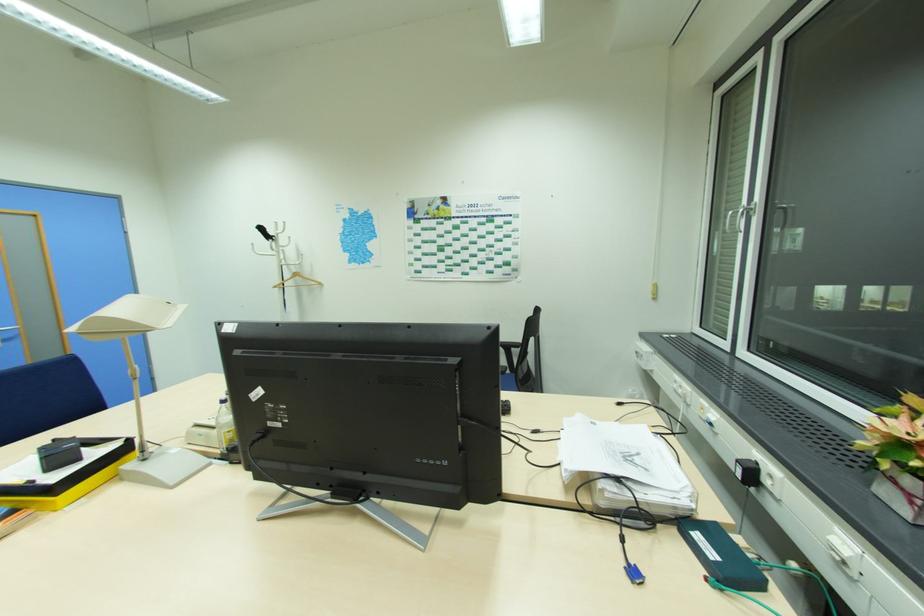
The width and height of the screenshot is (924, 616). Describe the element at coordinates (843, 554) in the screenshot. I see `the white power switch` at that location.